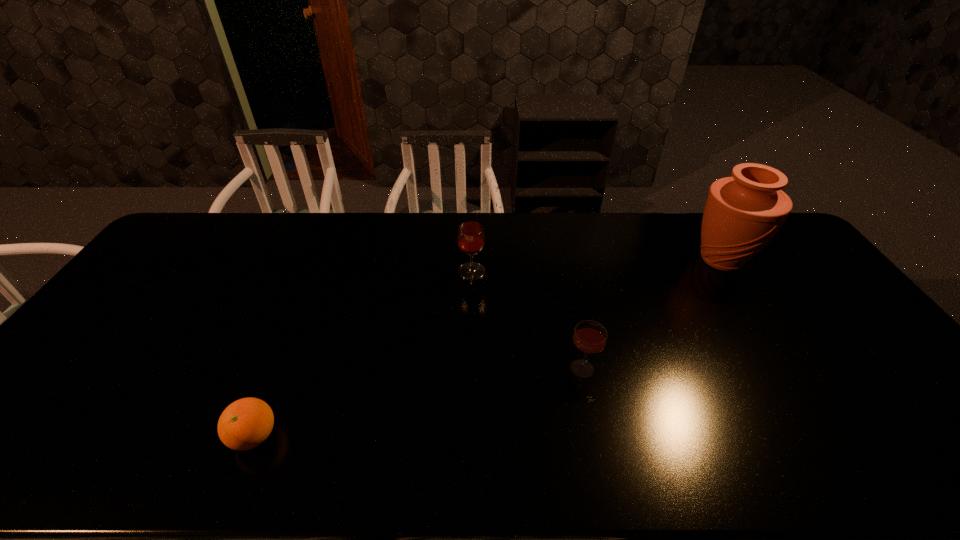
Locate an element on the screen. unoccupied area between the rightmost object and the third object from left to right is located at coordinates (652, 314).

Locate an element on the screen. free space between the orange and the rightmost object is located at coordinates pyautogui.click(x=488, y=348).

Where is `vacant area that lies between the nearest object and the third object from right to left`? The image size is (960, 540). vacant area that lies between the nearest object and the third object from right to left is located at coordinates (363, 354).

Identify the location of unoccupied position between the nearer wineglass and the shortest object. This screenshot has height=540, width=960. (419, 402).

Find the location of `empty space between the third object from left to right and the nearest object`. empty space between the third object from left to right and the nearest object is located at coordinates (419, 402).

At what (x,y) coordinates should I click in order to perform the action: click on empty space that is in between the tallest object and the farther wineglass. Please return your answer as a coordinate pair (x, y). This screenshot has height=540, width=960. Looking at the image, I should click on (596, 266).

You are a GUI agent. You are given a task and a screenshot of the screen. Output one action in this format:
    pyautogui.click(x=<x>, y=<y>)
    Task: Click on the unoccupied area between the leftmost object and the third object from right to left
    
    Given the screenshot: What is the action you would take?
    pyautogui.click(x=363, y=354)

Find the location of a particular element. The image size is (960, 540). unoccupied position between the taller wineglass and the second nearest object is located at coordinates (527, 320).

Identify the location of object that is the second nearest to the nearer wineglass. (743, 213).

Identify which object is the third closest to the vase. Please provide its 2D coordinates. Your answer should be formatted as a tuple, i.e. [(x, y)], where the tuple contains the x and y coordinates of a point satisfying the conditions above.

[(246, 423)]